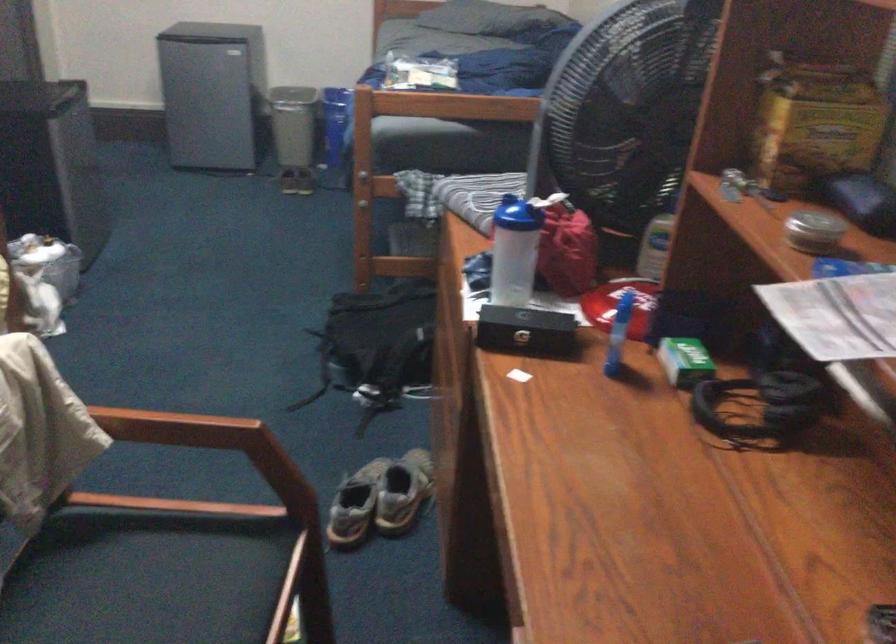
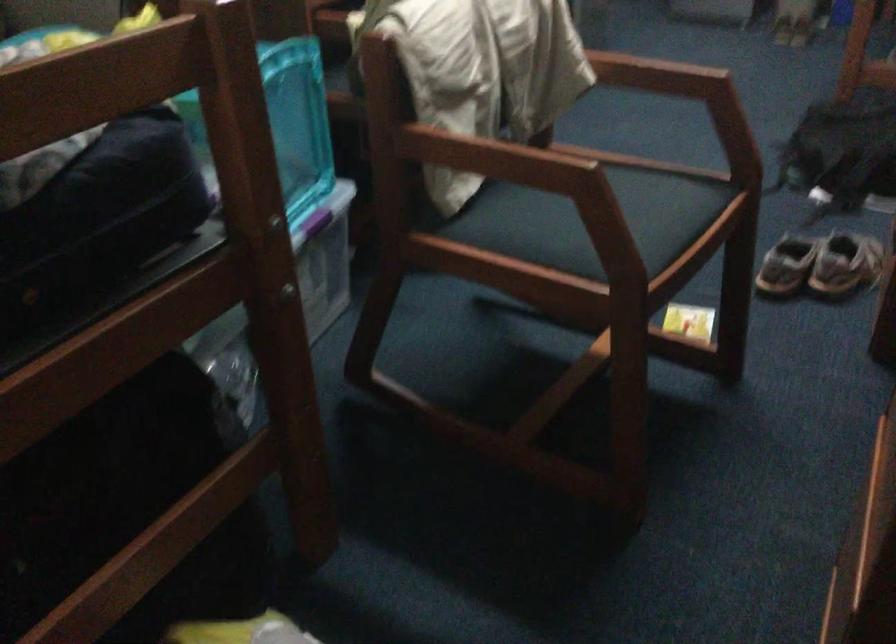
Question: How did the camera likely rotate?

Choices:
 (A) Left
 (B) Right
 (C) Up
 (D) Down

Answer: (A)